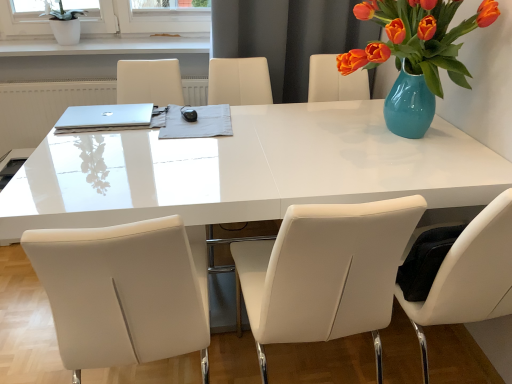
I want to click on free point below white ceramic pot at upper left (from a real-world perspective), so click(x=65, y=44).